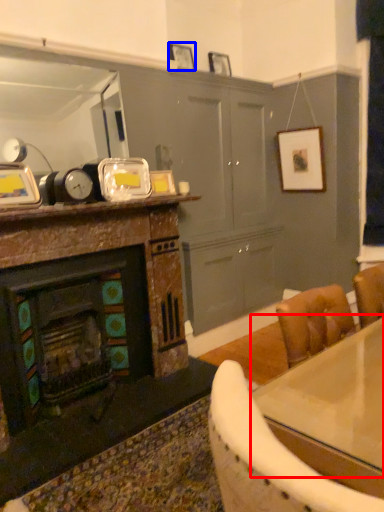
Question: Which of the following is the closest to the observer, counter top (highlighted by a red box) or picture frame (highlighted by a blue box)?

Choices:
 (A) counter top
 (B) picture frame

Answer: (A)